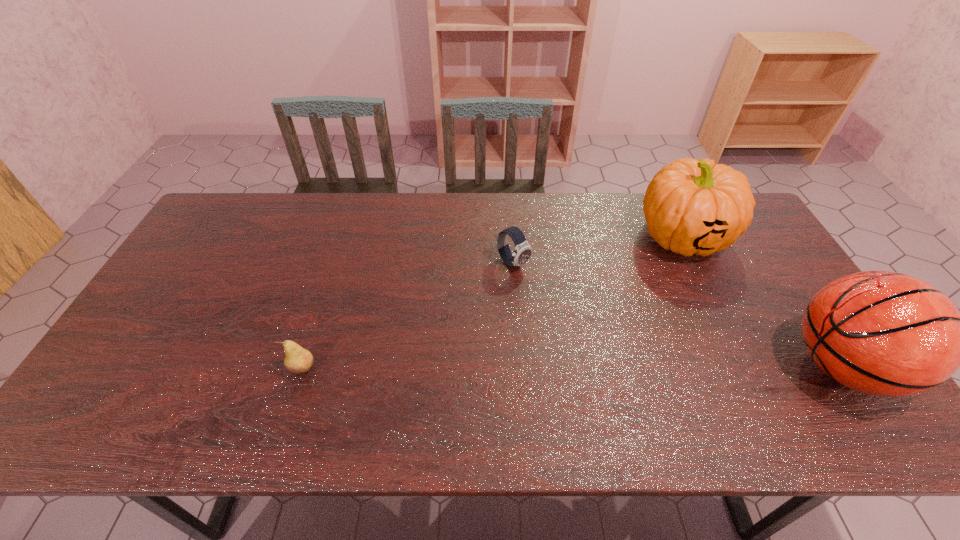
You are a GUI agent. You are given a task and a screenshot of the screen. Output one action in this format:
    pyautogui.click(x=<x>, y=<y>)
    Task: Click on the free area in between the basketball and the pear
    Image resolution: width=960 pixels, height=540 pixels.
    Given the screenshot: What is the action you would take?
    pyautogui.click(x=572, y=368)

Find the location of `vacant space that is in between the leftmost object and the watch`. vacant space that is in between the leftmost object and the watch is located at coordinates (408, 316).

You are a GUI agent. You are given a task and a screenshot of the screen. Output one action in this format:
    pyautogui.click(x=<x>, y=<y>)
    Task: Click on the vacant space that's between the basketball and the leftmost object
    
    Given the screenshot: What is the action you would take?
    pyautogui.click(x=572, y=368)

The image size is (960, 540). In order to click on free space between the pumpkin and the basketball in this screenshot , I will do `click(762, 301)`.

Find the location of a particular element. This screenshot has height=540, width=960. object that is the third closest to the watch is located at coordinates (883, 333).

Identify which object is located as the nearest to the leftmost object. Please provide its 2D coordinates. Your answer should be formatted as a tuple, i.e. [(x, y)], where the tuple contains the x and y coordinates of a point satisfying the conditions above.

[(523, 251)]

This screenshot has width=960, height=540. What are the coordinates of `vacant point that satisfies the following two spatial constraints: 1. on the back side of the basketball; 2. on the side with spill of the leftmost object` in the screenshot? It's located at (303, 367).